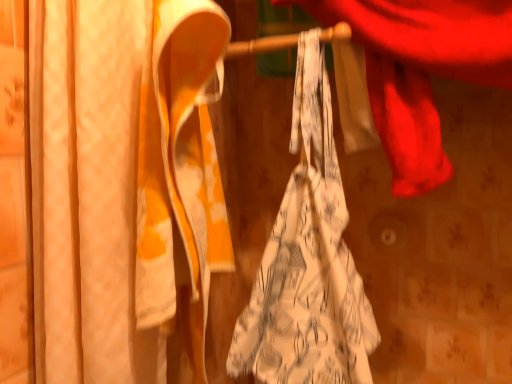
Question: From the image's perspective, is white printed fabric at center above or below matte white curtain at left?

Choices:
 (A) below
 (B) above

Answer: (A)

Question: Considering the positions of white printed fabric at center and matte white curtain at left in the image, is white printed fabric at center wider or thinner than matte white curtain at left?

Choices:
 (A) wide
 (B) thin

Answer: (B)

Question: From their relative heights in the image, would you say white printed fabric at center is taller or shorter than matte white curtain at left?

Choices:
 (A) tall
 (B) short

Answer: (B)

Question: Is matte white curtain at left wider or thinner than white printed fabric at center?

Choices:
 (A) thin
 (B) wide

Answer: (B)

Question: Is point (202, 172) positioned closer to the camera than point (300, 306)?

Choices:
 (A) closer
 (B) farther

Answer: (A)

Question: From the image's perspective, is matte white curtain at left located above or below white printed fabric at center?

Choices:
 (A) below
 (B) above

Answer: (B)

Question: From their relative heights in the image, would you say matte white curtain at left is taller or shorter than white printed fabric at center?

Choices:
 (A) short
 (B) tall

Answer: (B)